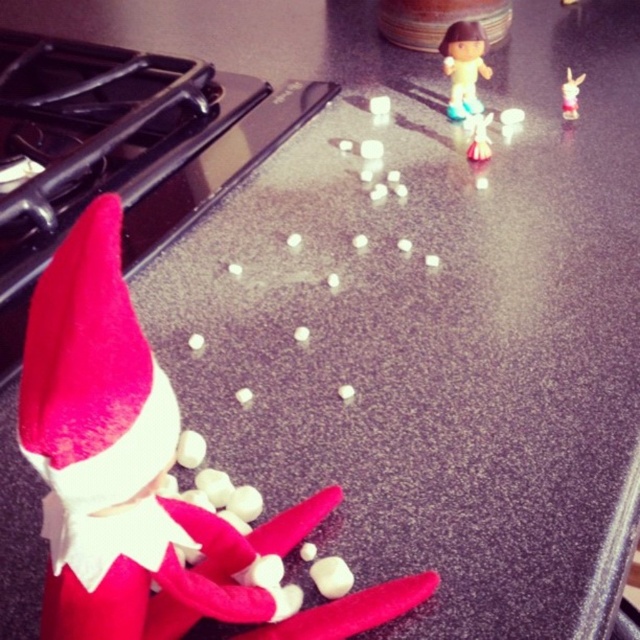
Image resolution: width=640 pixels, height=640 pixels. What do you see at coordinates (464, 67) in the screenshot? I see `smooth plastic doll at upper center` at bounding box center [464, 67].

Locate an element on the screen. The image size is (640, 640). smooth plastic doll at upper center is located at coordinates point(464,67).

Describe the element at coordinates (124, 465) in the screenshot. I see `felt red elf at lower left` at that location.

Who is higher up, felt red elf at lower left or white glossy rabbit at upper right?

Positioned higher is white glossy rabbit at upper right.

Locate an element on the screen. The height and width of the screenshot is (640, 640). felt red elf at lower left is located at coordinates (124, 465).

Which is in front, point (490, 154) or point (579, 83)?

Positioned in front is point (490, 154).

Is point (476, 154) more distant than point (572, 90)?

No, it is not.

Is point (472, 138) less distant than point (576, 109)?

Yes, point (472, 138) is closer to viewer.

Locate an element on the screen. matte plastic figurine at upper center is located at coordinates (480, 140).